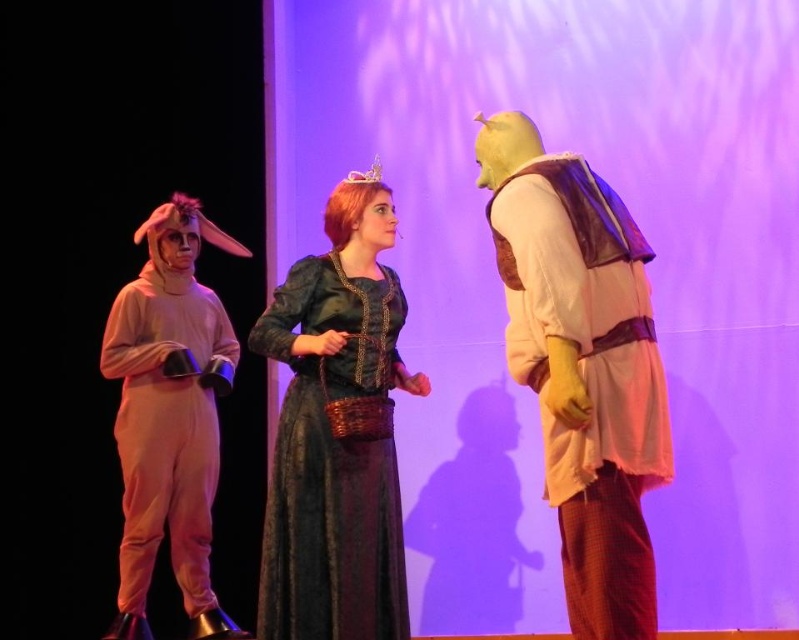
You are a costume designer observing the stage setup. You need to determine which costume has a wider silhouette between the smooth beige vest at right and the velvet green dress at center. According to the description, which one is wider?

The velvet green dress at center has a wider silhouette than the smooth beige vest at right because the smooth beige vest at right is narrower in width compared to the velvet green dress at center.

You are an audience member sitting in the front row of the theater. You notice two points on the stage marked as point 1 at coordinates point (396, 321) and point 2 at coordinates point (129, 387). Which point do you think is closer to your position?

Point 1 at coordinates point (396, 321) is closer to the viewer than point 2 at coordinates point (129, 387).